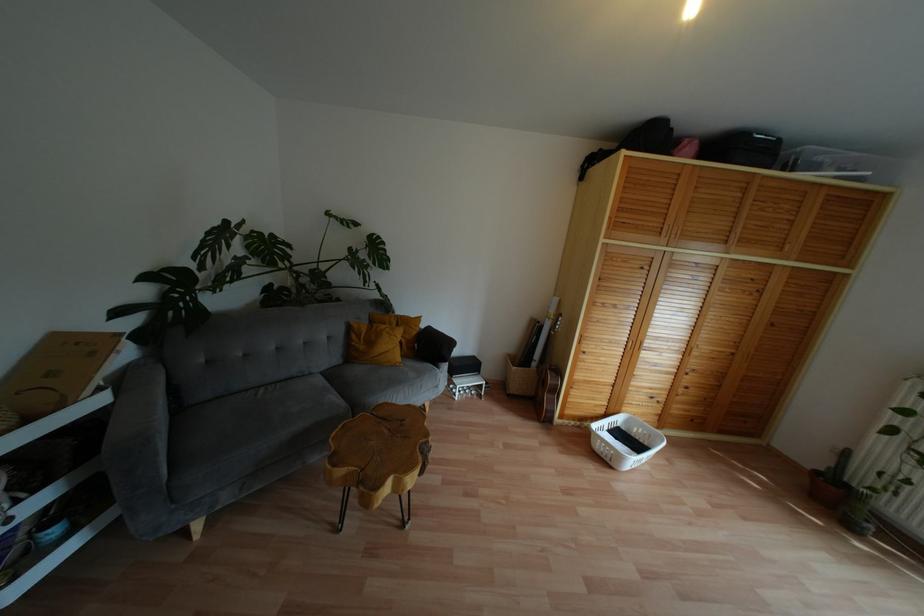
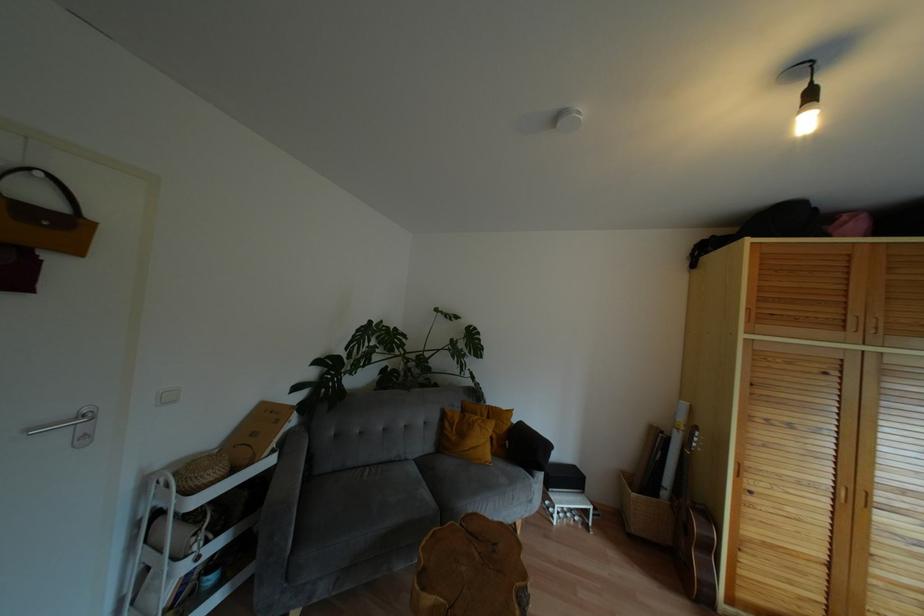
In the second image, find the point that corresponds to (x=327, y=384) in the first image.

(419, 476)